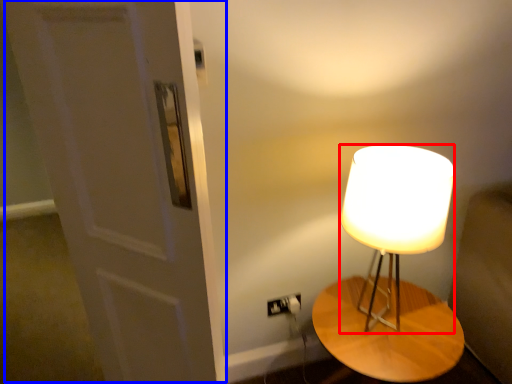
Question: Which object appears closest to the camera in this image, lamp (highlighted by a red box) or door (highlighted by a blue box)?

Choices:
 (A) lamp
 (B) door

Answer: (B)